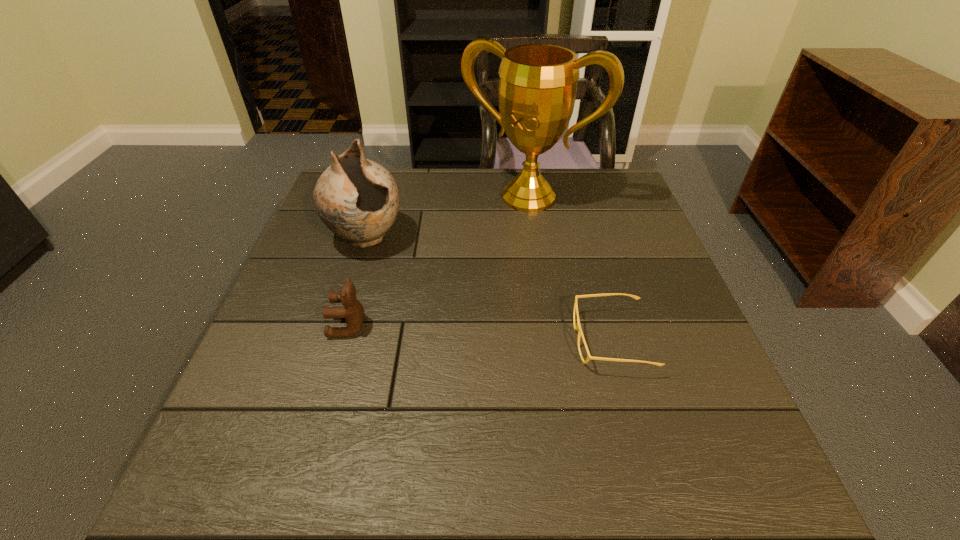
Find the location of `teddy bear`. teddy bear is located at coordinates click(353, 312).

Where is `the shortest object`? the shortest object is located at coordinates (578, 327).

You are a GUI agent. You are given a task and a screenshot of the screen. Output one action in this format:
    pyautogui.click(x=<x>, y=<y>)
    Task: Click on the award
    
    Given the screenshot: What is the action you would take?
    pyautogui.click(x=537, y=89)

At what (x,y) coordinates should I click in order to perform the action: click on the second tallest object. Please return your answer as a coordinate pair (x, y). Looking at the image, I should click on (358, 199).

This screenshot has width=960, height=540. Identify the location of vacant space located on the face of the teddy bear. (266, 326).

At what (x,y) coordinates should I click in order to perform the action: click on vacant space located on the face of the teddy bear. Please return your answer as a coordinate pair (x, y). This screenshot has width=960, height=540. Looking at the image, I should click on (279, 326).

The height and width of the screenshot is (540, 960). I want to click on vacant space situated in front of the lenses of the shortest object, so click(x=436, y=340).

This screenshot has width=960, height=540. In order to click on free space located in front of the lenses of the shortest object in this screenshot , I will do `click(402, 340)`.

This screenshot has width=960, height=540. I want to click on vacant space located in front of the lenses of the shortest object, so click(x=469, y=340).

Locate an element on the screen. This screenshot has width=960, height=540. blank area located 0.220m on the front-facing side of the tallest object is located at coordinates (476, 262).